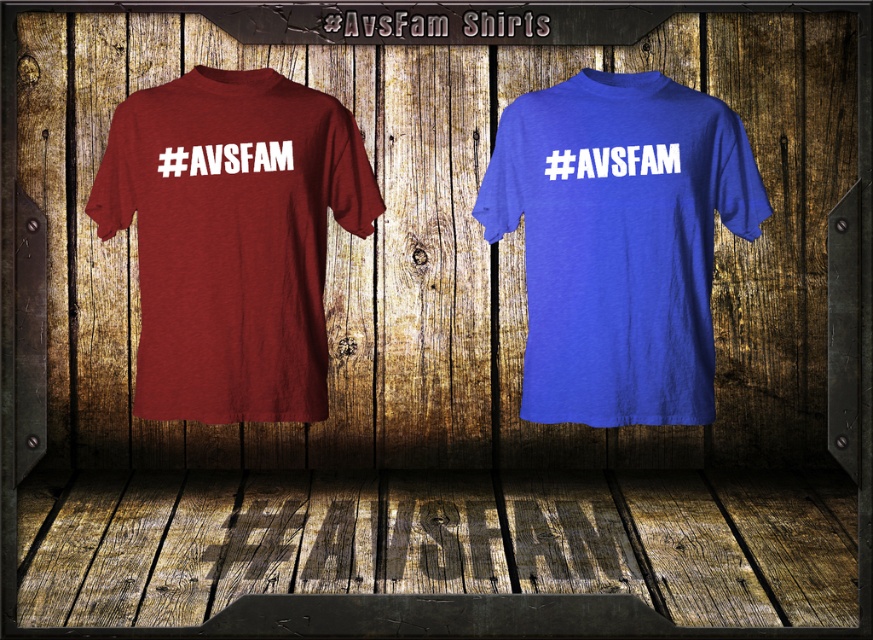
Question: Is maroon heather tee at left below royal blue t-shirt at right?

Choices:
 (A) no
 (B) yes

Answer: (A)

Question: Which of the following is the farthest from the observer?

Choices:
 (A) (340, 193)
 (B) (597, 276)

Answer: (A)

Question: Does maroon heather tee at left appear on the right side of royal blue t-shirt at right?

Choices:
 (A) no
 (B) yes

Answer: (A)

Question: Which of the following is the closest to the observer?

Choices:
 (A) (514, 227)
 (B) (235, 308)

Answer: (B)

Question: Does maroon heather tee at left appear on the left side of royal blue t-shirt at right?

Choices:
 (A) no
 (B) yes

Answer: (B)